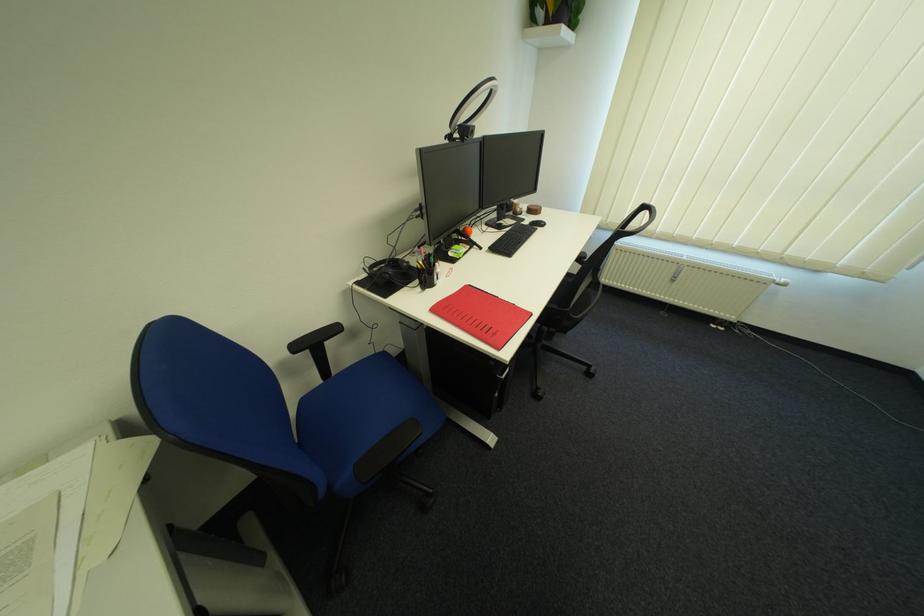
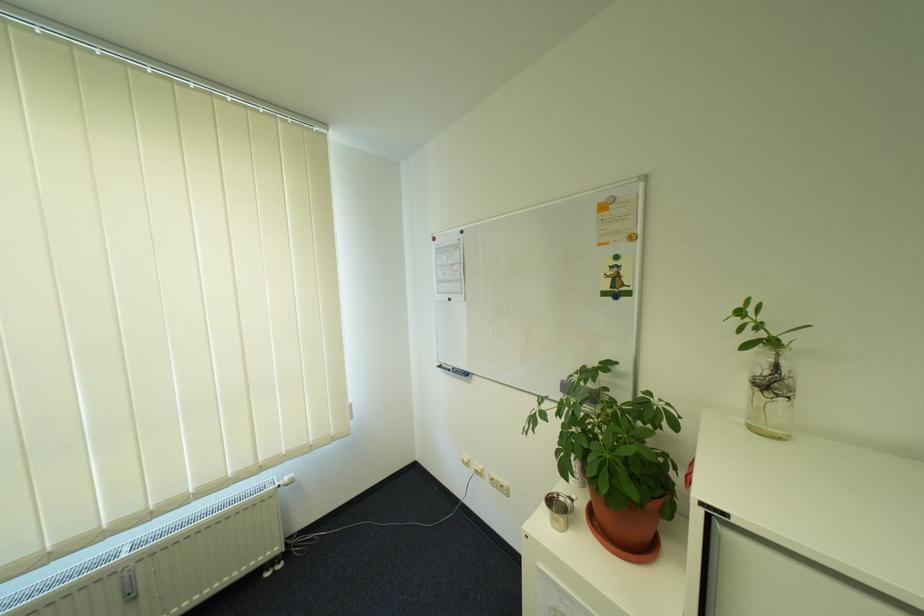
Find the pixel in the second image that matches point (786, 281) in the first image.

(290, 484)